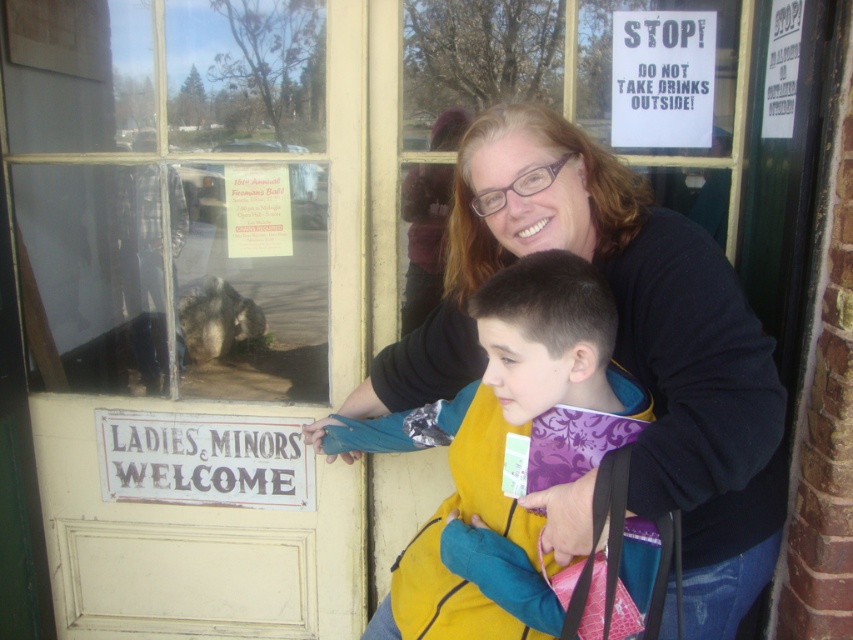
Question: Among these points, which one is farthest from the camera?

Choices:
 (A) (544, 401)
 (B) (154, 452)
 (C) (126, 572)
 (D) (677, 42)

Answer: (C)

Question: Does white painted wood sign at lower left have a larger size compared to white paper sign at upper right?

Choices:
 (A) no
 (B) yes

Answer: (B)

Question: Can you confirm if white painted wood sign at lower left is positioned above white paper sign at upper right?

Choices:
 (A) yes
 (B) no

Answer: (B)

Question: Does white painted wood door at center appear on the right side of white paper sign at upper right?

Choices:
 (A) yes
 (B) no

Answer: (B)

Question: Among these points, which one is nearest to the camera?

Choices:
 (A) (631, 40)
 (B) (318, 634)
 (C) (228, 464)
 (D) (556, 378)

Answer: (D)

Question: Based on their relative distances, which object is farther from the white painted wood door at center?

Choices:
 (A) yellow fleece vest at center
 (B) white paper sign at upper right

Answer: (B)